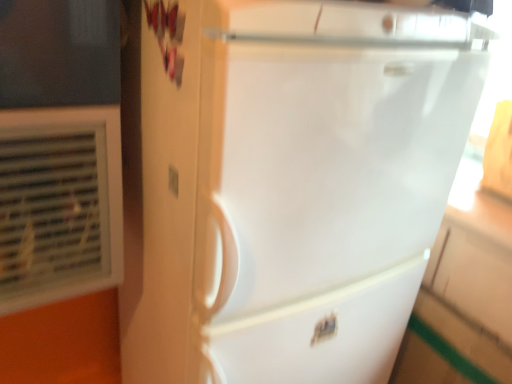
Question: Can you confirm if white plastic air conditioning unit at left is positioned to the right of matte white outlet at center?

Choices:
 (A) yes
 (B) no

Answer: (B)

Question: Can you confirm if white plastic air conditioning unit at left is positioned to the left of matte white outlet at center?

Choices:
 (A) yes
 (B) no

Answer: (A)

Question: Does white plastic air conditioning unit at left have a greater width compared to matte white outlet at center?

Choices:
 (A) yes
 (B) no

Answer: (A)

Question: Does white plastic air conditioning unit at left lie behind matte white outlet at center?

Choices:
 (A) yes
 (B) no

Answer: (B)

Question: Is white plastic air conditioning unit at left positioned far away from matte white outlet at center?

Choices:
 (A) yes
 (B) no

Answer: (B)

Question: Considering the positions of white plastic air conditioning unit at left and matte white outlet at center in the image, is white plastic air conditioning unit at left wider or thinner than matte white outlet at center?

Choices:
 (A) thin
 (B) wide

Answer: (B)

Question: Is white plastic air conditioning unit at left bigger or smaller than matte white outlet at center?

Choices:
 (A) big
 (B) small

Answer: (A)

Question: From the image's perspective, is white plastic air conditioning unit at left located above or below matte white outlet at center?

Choices:
 (A) below
 (B) above

Answer: (B)

Question: In the image, is white plastic air conditioning unit at left positioned in front of or behind matte white outlet at center?

Choices:
 (A) behind
 (B) front

Answer: (B)

Question: From the image's perspective, is white plastic air conditioning unit at left located above or below white glossy refrigerator at center?

Choices:
 (A) below
 (B) above

Answer: (B)

Question: Is point (112, 139) closer or farther from the camera than point (345, 13)?

Choices:
 (A) farther
 (B) closer

Answer: (A)

Question: Is white plastic air conditioning unit at left spatially inside white glossy refrigerator at center, or outside of it?

Choices:
 (A) outside
 (B) inside

Answer: (A)

Question: Is white plastic air conditioning unit at left in front of or behind white glossy refrigerator at center in the image?

Choices:
 (A) front
 (B) behind

Answer: (B)

Question: From a real-world perspective, is white glossy refrigerator at center above or below matte white outlet at center?

Choices:
 (A) above
 (B) below

Answer: (B)

Question: In the image, is white glossy refrigerator at center positioned in front of or behind matte white outlet at center?

Choices:
 (A) front
 (B) behind

Answer: (A)